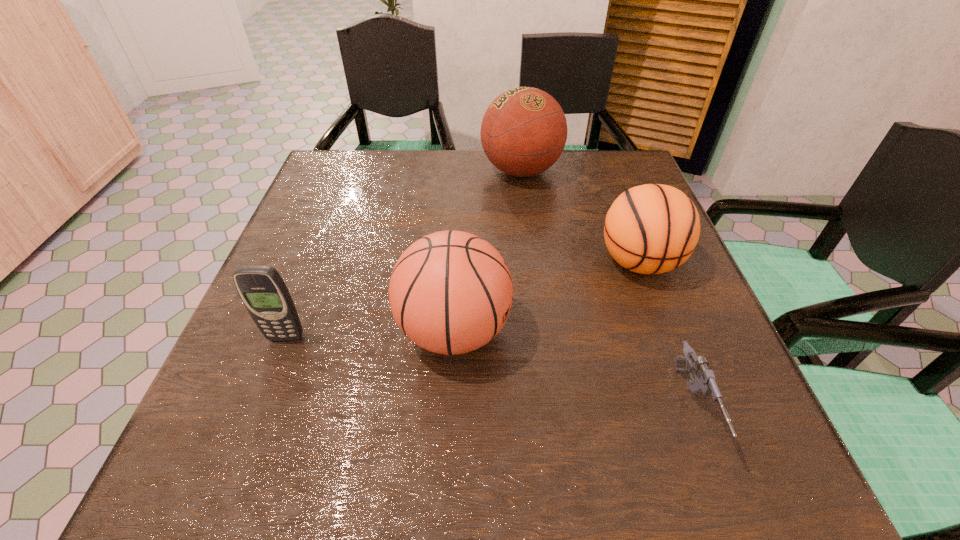
Locate an element on the screen. The width and height of the screenshot is (960, 540). the farthest basketball is located at coordinates (523, 133).

Find the location of a particular element. the shortest basketball is located at coordinates pyautogui.click(x=650, y=229).

Find the location of `the leftmost object`. the leftmost object is located at coordinates (264, 293).

The image size is (960, 540). I want to click on gun, so click(703, 382).

Where is `free spot located 0.230m on the front of the farthest object`? free spot located 0.230m on the front of the farthest object is located at coordinates (531, 255).

Find the location of a particular element. vacant space located 0.070m on the left of the shortest basketball is located at coordinates (564, 262).

Find the location of a particular element. blank area located 0.150m on the screen of the cellular telephone is located at coordinates (254, 419).

This screenshot has width=960, height=540. Identify the location of object located in the far edge section of the desktop. (523, 133).

I want to click on object at the near edge, so click(703, 382).

I want to click on object located in the left edge section of the desktop, so click(x=264, y=293).